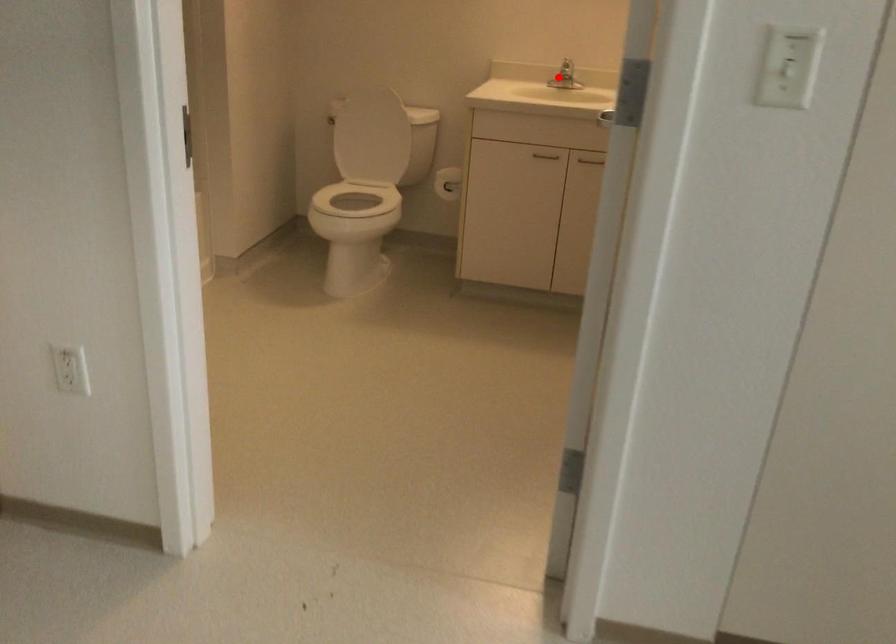
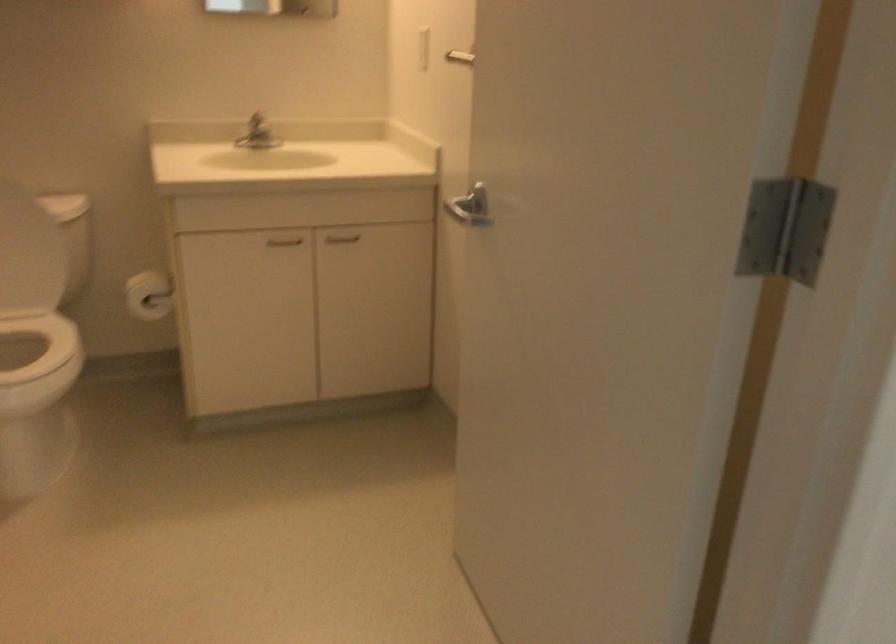
Question: I am providing you with two images of the same scene from different viewpoints. In image1, a red point is highlighted. Considering the same 3D point in image2, which of the following is correct?

Choices:
 (A) It is closer
 (B) It is farther

Answer: (A)